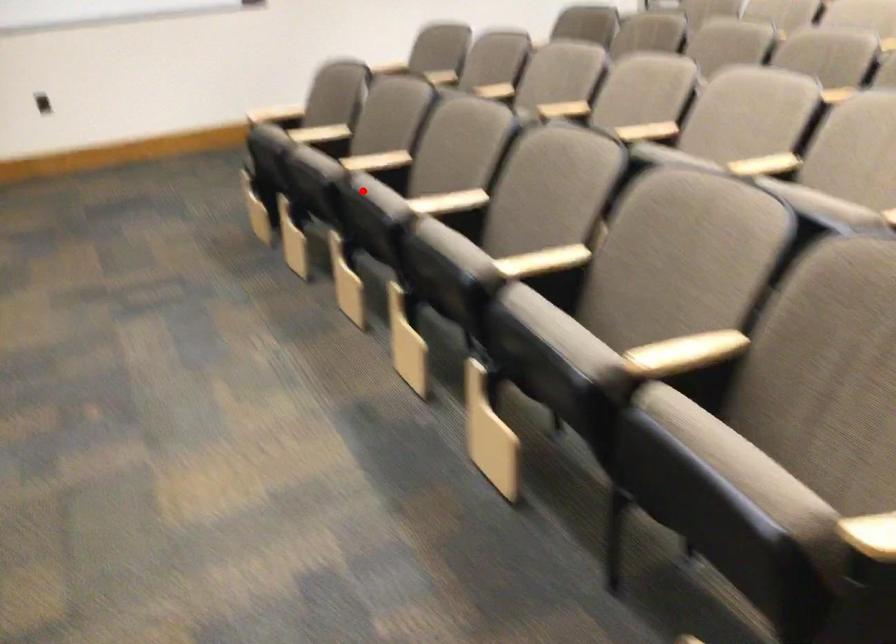
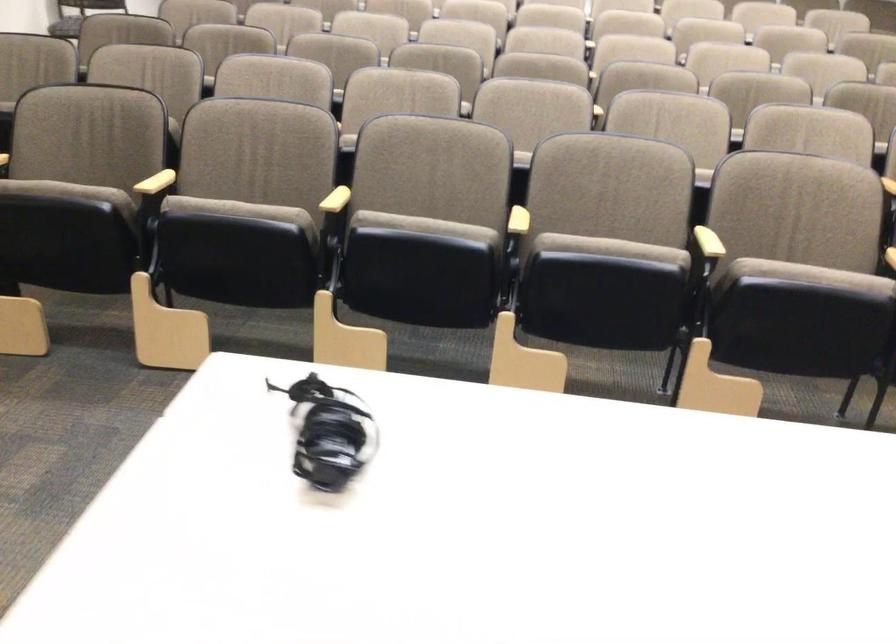
Locate, in the second image, the point that corresponds to the highlighted location in the first image.

(424, 225)